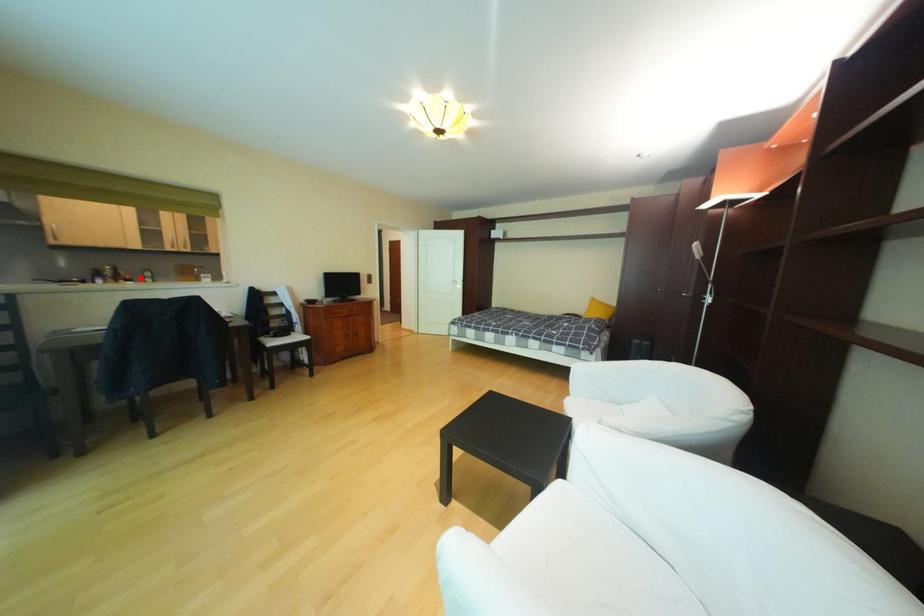
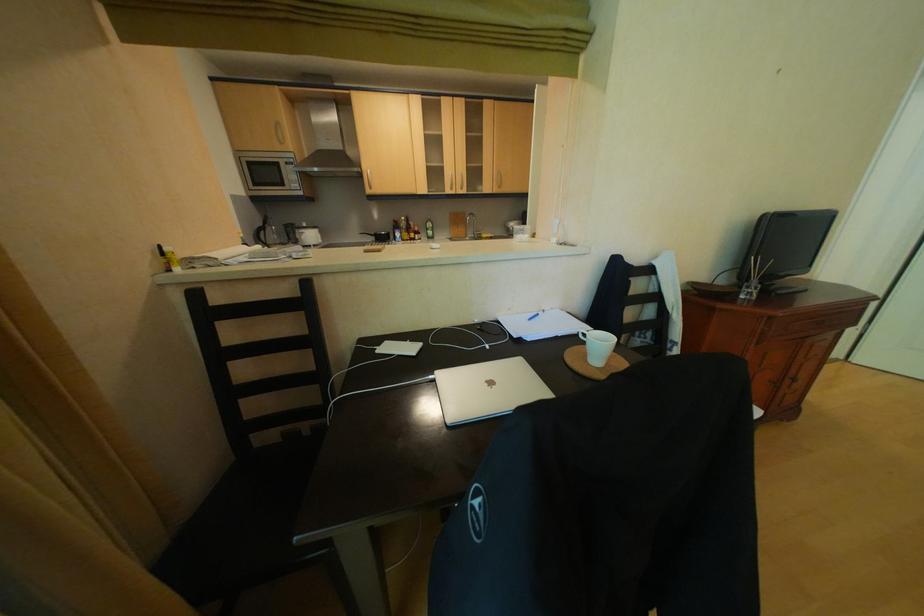
Locate, in the second image, the point that corresponds to the highlighted location in the first image.

(429, 230)